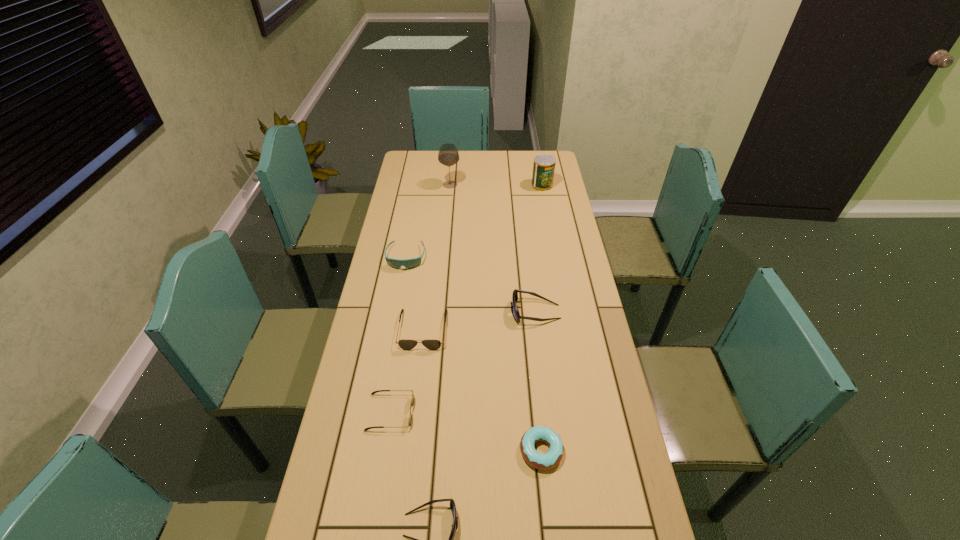
Locate an element on the screen. This screenshot has height=540, width=960. can present at the right edge is located at coordinates (544, 165).

I want to click on sunglasses that is at the right edge, so [516, 315].

In the image, there is a desktop. Where is `vacant space at the far edge`? This screenshot has height=540, width=960. vacant space at the far edge is located at coordinates (463, 168).

At what (x,y) coordinates should I click in order to perform the action: click on vacant space at the left edge. Please return your answer as a coordinate pair (x, y). The image size is (960, 540). Looking at the image, I should click on (425, 182).

In the image, there is a desktop. Find the location of `vacant space at the right edge`. vacant space at the right edge is located at coordinates (x=599, y=387).

You are a GUI agent. You are given a task and a screenshot of the screen. Output one action in this format:
    pyautogui.click(x=<x>, y=<y>)
    Task: Click on the free space at the far left corner of the desktop
    
    Given the screenshot: What is the action you would take?
    pyautogui.click(x=416, y=166)

What are the coordinates of `unoccupied position between the smaller black sunglasses and the gray wineglass` in the screenshot? It's located at (420, 299).

The width and height of the screenshot is (960, 540). Identify the location of free point between the sixth nearest object and the wineglass. (428, 221).

Where is `vacant point located between the second nearest sunglasses and the gray wineglass`? vacant point located between the second nearest sunglasses and the gray wineglass is located at coordinates (420, 299).

Locate an element on the screen. The width and height of the screenshot is (960, 540). free space between the gray wineglass and the doughnut is located at coordinates (495, 318).